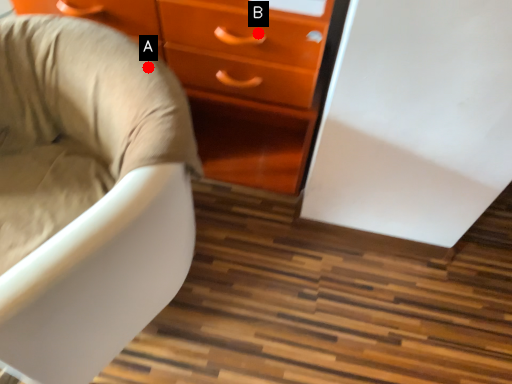
Question: Two points are circled on the image, labeled by A and B beside each circle. Which point is closer to the camera taking this photo?

Choices:
 (A) A is closer
 (B) B is closer

Answer: (A)